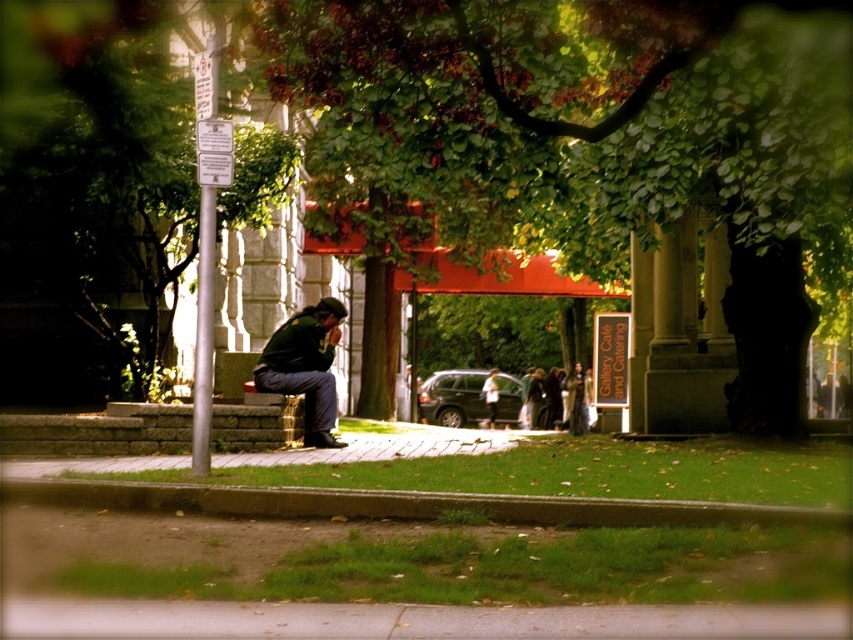
Question: Which point is farther to the camera?

Choices:
 (A) (583, 614)
 (B) (701, 522)
 (C) (318, 412)
 (D) (465, 24)

Answer: (C)

Question: Does green leafy tree at left come behind green fabric jacket at center?

Choices:
 (A) yes
 (B) no

Answer: (B)

Question: Which point appears farthest from the camera in this image?

Choices:
 (A) (799, 99)
 (B) (1, 234)
 (C) (376, 634)

Answer: (B)

Question: In this image, where is green leafy tree at left located relative to green fabric jacket at center?

Choices:
 (A) left
 (B) right

Answer: (A)

Question: Which of the following is the farthest from the observer?

Choices:
 (A) gray concrete pavement at lower center
 (B) green leafy tree at left

Answer: (B)

Question: Is the position of concrete curb at lower center more distant than that of white cotton shirt at center?

Choices:
 (A) yes
 (B) no

Answer: (B)